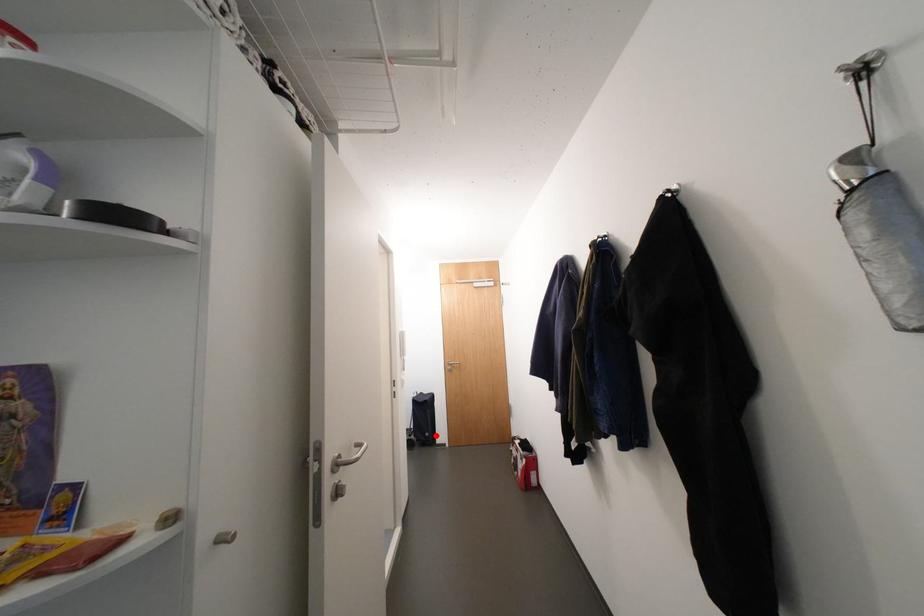
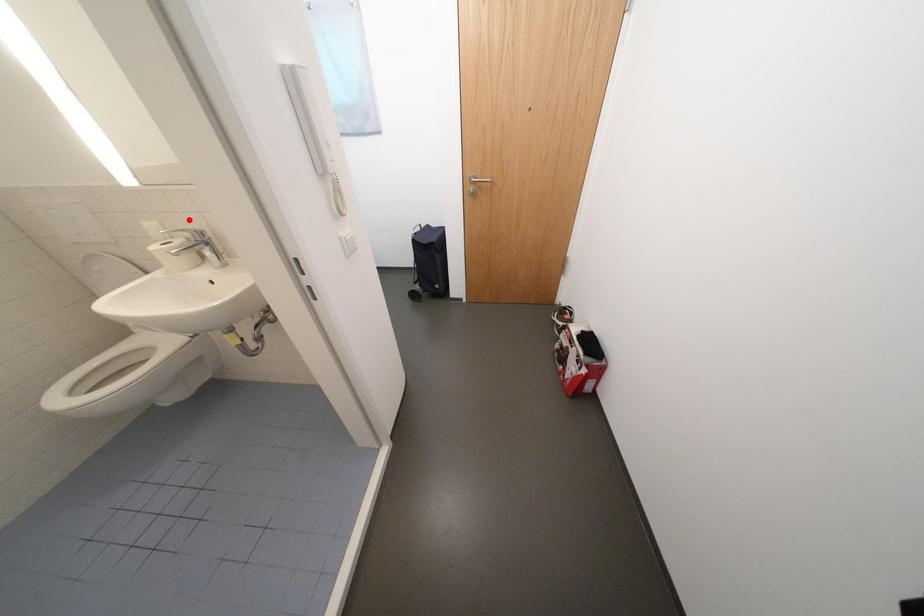
I am providing you with two images of the same scene from different viewpoints. A red point is marked on the first image and another point is marked on the second image. Are the points marked in image1 and image2 representing the same 3D position?

No